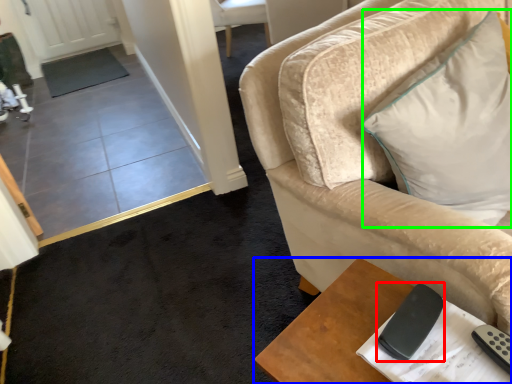
Question: Considering the real-world distances, which object is farthest from remote (highlighted by a red box)? table (highlighted by a blue box) or pillow (highlighted by a green box)?

Choices:
 (A) table
 (B) pillow

Answer: (B)